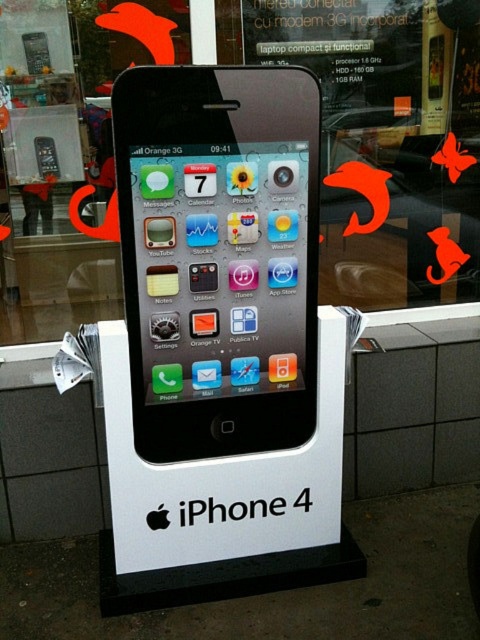
Measure the distance between point (x=274, y=273) and camera.

Point (x=274, y=273) and camera are 6.47 feet apart.

Is point (301, 216) closer to camera compared to point (47, 148)?

Yes, it is in front of point (47, 148).

Locate an element on the screen. matte black iphone 4 at center is located at coordinates (218, 256).